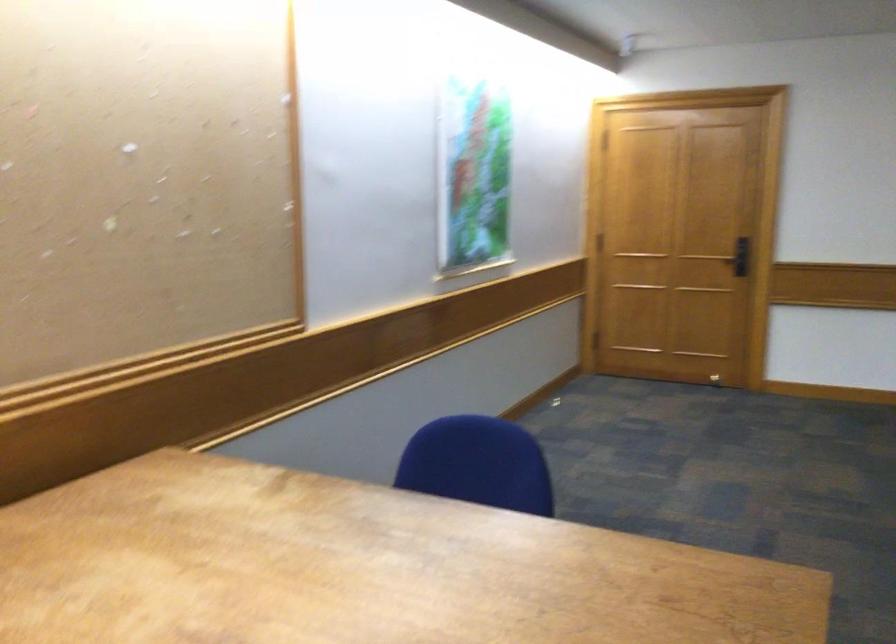
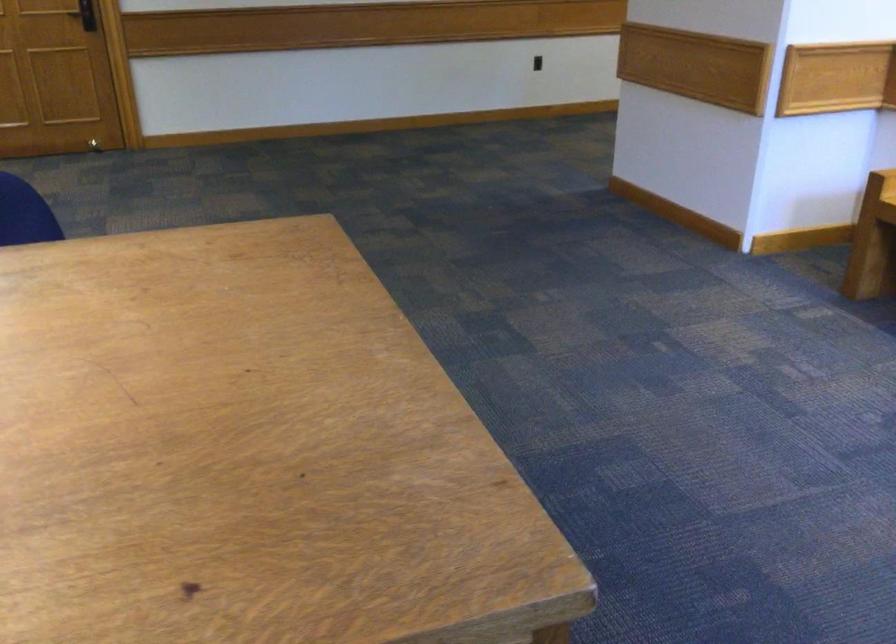
How did the camera likely rotate?

The camera's rotation is toward right-down.